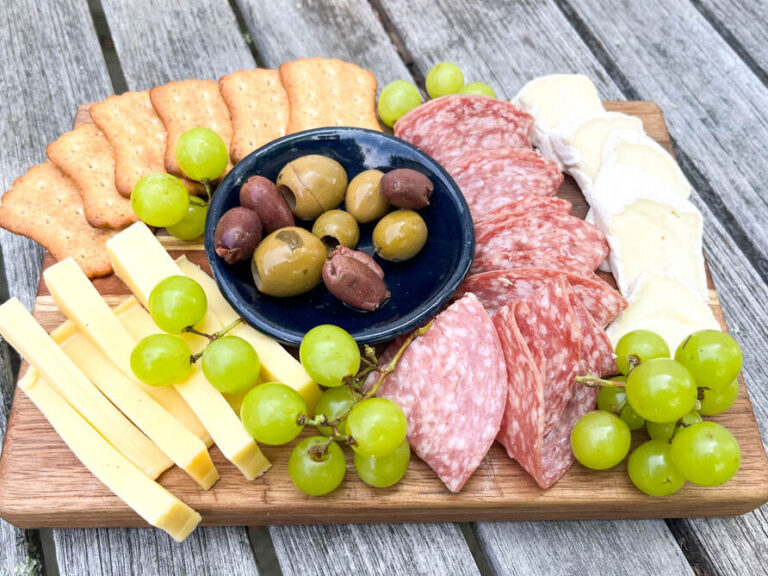
This screenshot has height=576, width=768. I want to click on blue dish, so click(412, 306).